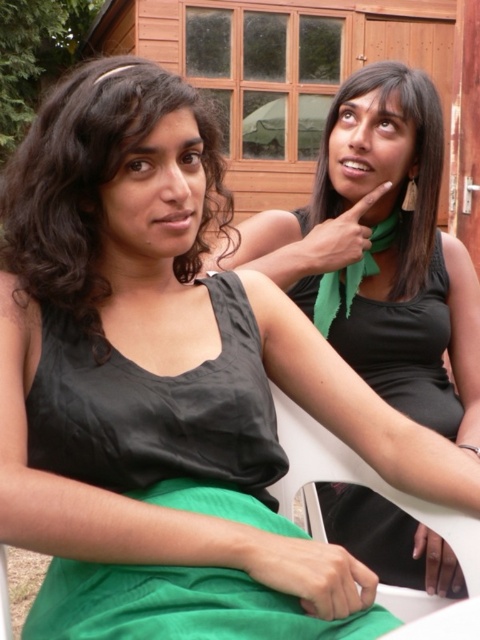
You are a photographer trying to capture a clear shot of both the black matte dress at center and the green matte scarf at upper right. Which object should you focus on first to ensure both are in focus?

You should focus on the black matte dress at center first since it is closer to the viewer than the green matte scarf at upper right, ensuring both will be in focus when using depth of field appropriately.

You are a photographer trying to capture both the matte black dress at left and the black matte dress at center in a single shot. Which dress should you focus on first to ensure both are in sharp focus?

You should focus on the matte black dress at left first because it is closer to the viewer, ensuring that both it and the black matte dress at center will be in focus when using a proper depth of field.

You are standing in front of a clothing rack and see two dresses. The first is the matte black dress at left, and the second is the black matte dress at center. Which dress is positioned higher on the rack?

The matte black dress at left is positioned higher on the rack than the black matte dress at center.